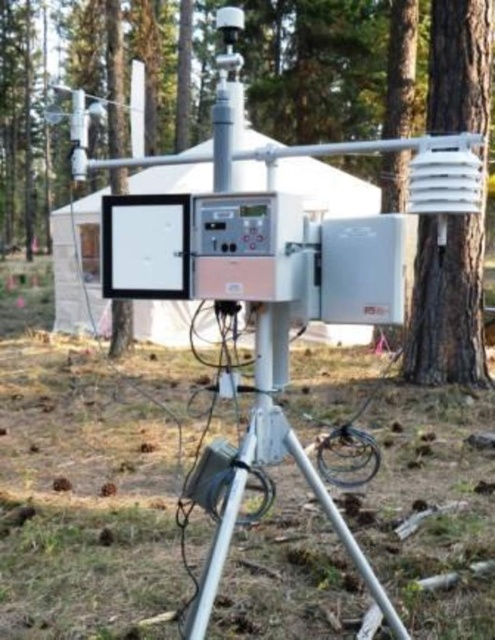
You are a field researcher who needs to set up a weather station. The white plastic tent at center is your current location. The silver metallic tripod at lower center is where you need to place the equipment. Can you safely walk directly to the tripod without encountering any obstacles?

The white plastic tent at center is 10.28 meters away from the silver metallic tripod at lower center. Since the distance is over 10 meters, you can safely walk directly to the tripod without encountering any obstacles.

You are a technician standing in front of the meteorological device. You need to adjust two points on the device, point [263,141] and point [339,516]. Which point should you adjust first if you want to start with the one closer to you?

You should adjust point [263,141] first because it is closer to you than point [339,516].

You are a technician who needs to reach a point marked at coordinates (x=365, y=328) in the image. Your current position is 10 meters away from the camera. Can you safely walk to that point without exceeding the 12 meter safety limit?

The distance of point (x=365, y=328) from the camera is 11.17 meters. Since you are currently 10 meters away from the camera, the total distance to the point is 11.17 meters, which is within the 12 meter safety limit. Therefore, you can safely walk to that point.